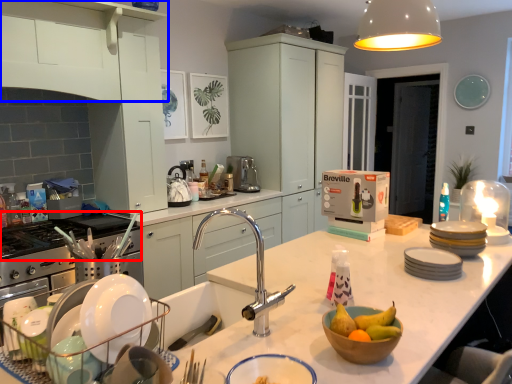
Question: Which point is further to the camera, gas stove (highlighted by a red box) or cabinetry (highlighted by a blue box)?

Choices:
 (A) gas stove
 (B) cabinetry

Answer: (A)